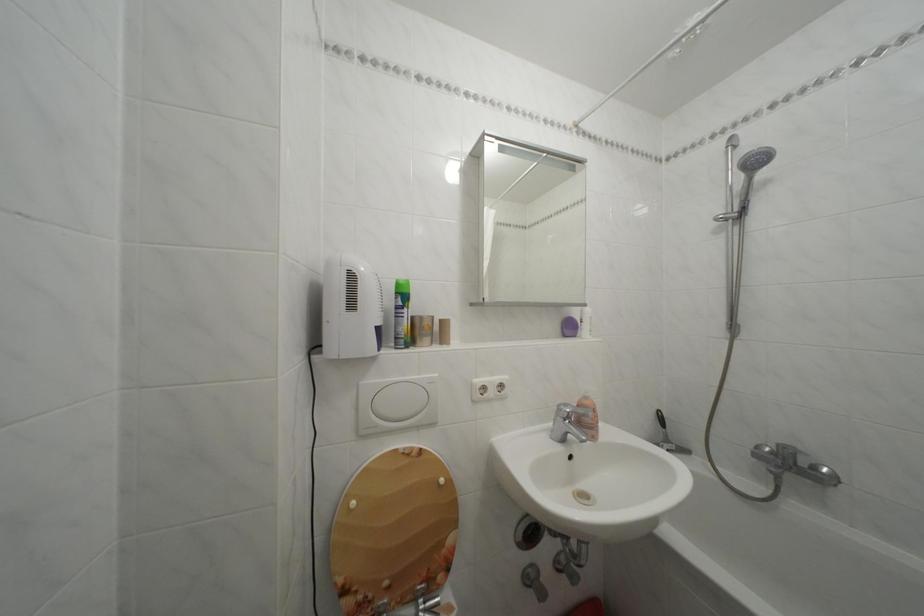
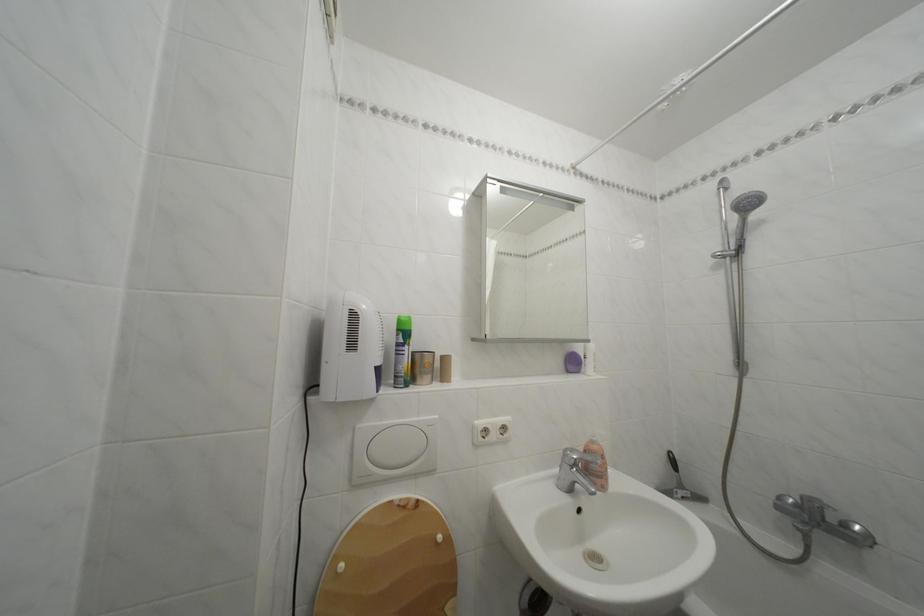
The point at (594, 403) is marked in the first image. Where is the corresponding point in the second image?

(602, 448)